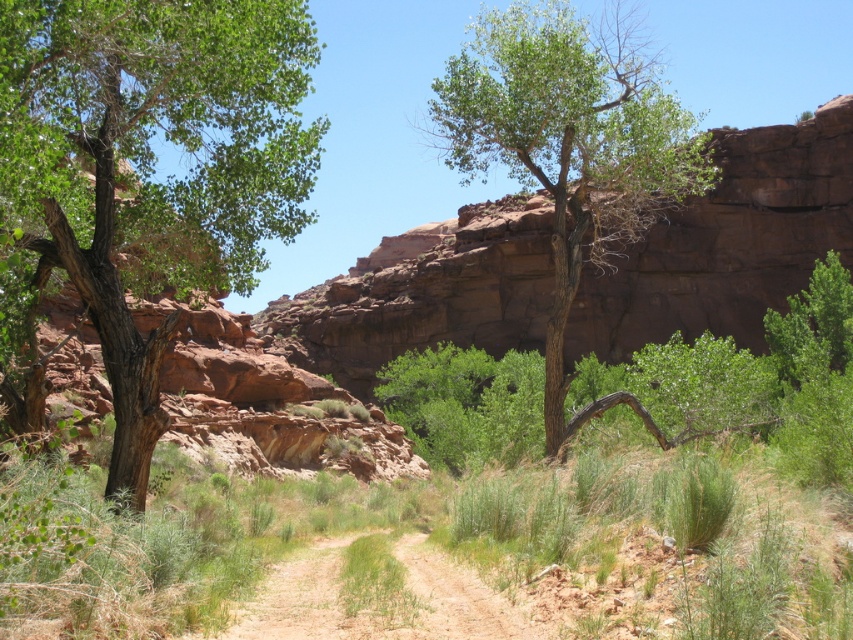
Question: Which object is farther from the camera taking this photo?

Choices:
 (A) brown sandy dirt track at center
 (B) green leafy tree at left

Answer: (B)

Question: Which object appears closest to the camera in this image?

Choices:
 (A) green leafy tree at center
 (B) brown sandy dirt track at center
 (C) green leafy tree at left

Answer: (B)

Question: Can you confirm if green leafy tree at left is thinner than green leafy tree at center?

Choices:
 (A) no
 (B) yes

Answer: (B)

Question: Is green leafy tree at left in front of green leafy tree at center?

Choices:
 (A) no
 (B) yes

Answer: (B)

Question: Is green leafy tree at left wider than brown sandy dirt track at center?

Choices:
 (A) yes
 (B) no

Answer: (A)

Question: Which point is closer to the camera?

Choices:
 (A) brown sandy dirt track at center
 (B) green leafy tree at center
 (C) green leafy tree at left

Answer: (A)